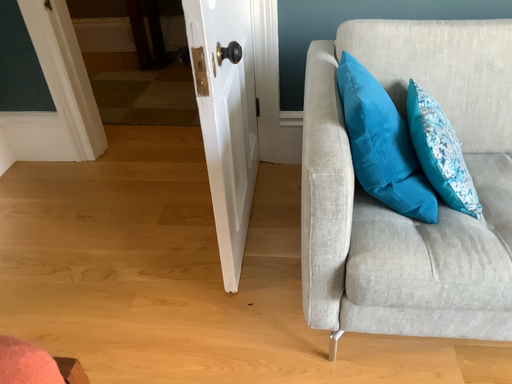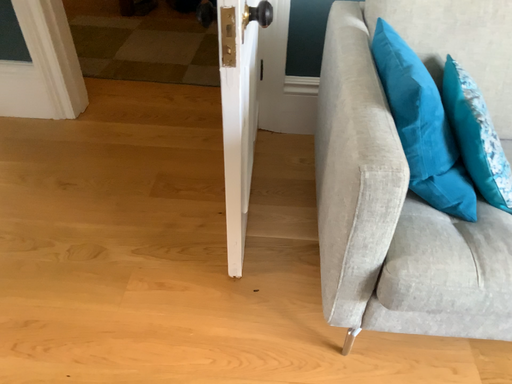
Question: Which way did the camera rotate in the video?

Choices:
 (A) rotated downward
 (B) rotated upward

Answer: (A)